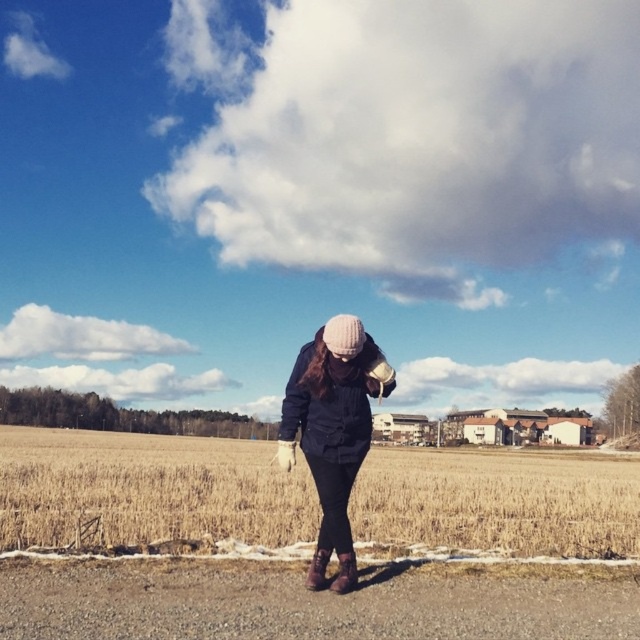
You are a photographer trying to capture the brown grass at center and the brown leather boot at lower center in the same frame. Based on their positions, can you determine which object is closer to the camera?

The brown grass at center is positioned under the brown leather boot at lower center, so the boot is closer to the camera than the grass.

You are a photographer trying to capture the person in the matte black jacket at center while ensuring the brown grass at center is visible in the frame. Based on their positions, which side of the jacket should you position the grass to achieve this?

The brown grass at center is to the left of the matte black jacket at center, so position the grass to the left side of the jacket in the frame to include both in the shot.